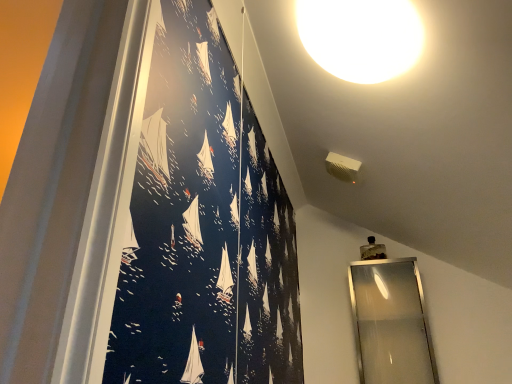
Question: From a real-world perspective, relative to silver metallic mirror at right, is white glossy light fixture at upper center vertically above or below?

Choices:
 (A) below
 (B) above

Answer: (B)

Question: Is white glossy light fixture at upper center in front of or behind silver metallic mirror at right in the image?

Choices:
 (A) front
 (B) behind

Answer: (A)

Question: Does point (352, 34) appear closer or farther from the camera than point (382, 307)?

Choices:
 (A) farther
 (B) closer

Answer: (B)

Question: In terms of width, does silver metallic mirror at right look wider or thinner when compared to white glossy light fixture at upper center?

Choices:
 (A) thin
 (B) wide

Answer: (A)

Question: Considering the positions of silver metallic mirror at right and white glossy light fixture at upper center in the image, is silver metallic mirror at right bigger or smaller than white glossy light fixture at upper center?

Choices:
 (A) small
 (B) big

Answer: (B)

Question: Visually, is silver metallic mirror at right positioned to the left or to the right of white glossy light fixture at upper center?

Choices:
 (A) left
 (B) right

Answer: (B)

Question: Considering their positions, is silver metallic mirror at right located in front of or behind white glossy light fixture at upper center?

Choices:
 (A) front
 (B) behind

Answer: (B)